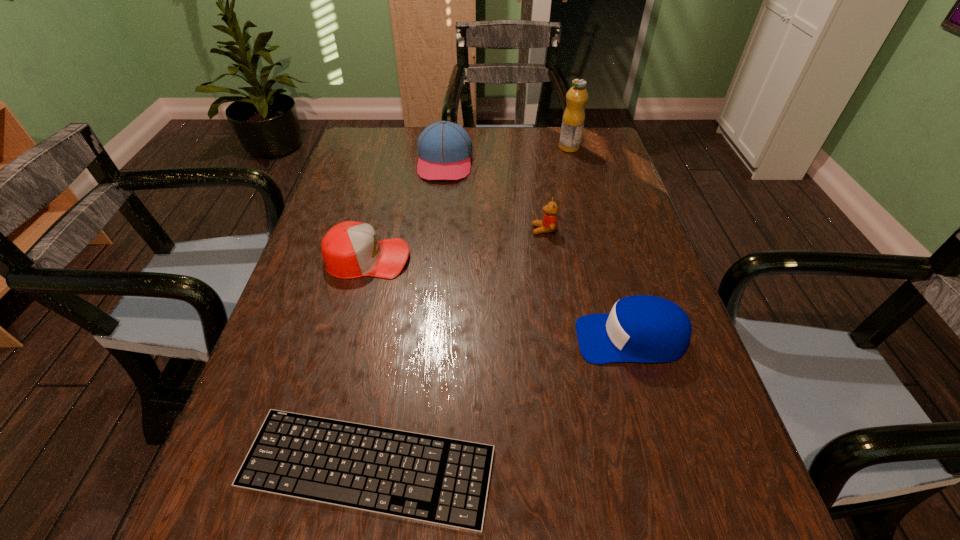
Identify the location of vacant position located on the front label of the fruit juice. Image resolution: width=960 pixels, height=540 pixels. (543, 147).

The height and width of the screenshot is (540, 960). In order to click on blank area located on the front label of the fruit juice in this screenshot , I will do `click(495, 147)`.

Find the location of a particular element. vacant area situated on the front-facing side of the tallest baseball cap is located at coordinates (438, 234).

At what (x,y) coordinates should I click in order to perform the action: click on vacant space situated on the front-facing side of the teddy bear. Please return your answer as a coordinate pair (x, y). The image size is (960, 540). Looking at the image, I should click on (410, 230).

This screenshot has height=540, width=960. I want to click on free spot located 0.260m on the front-facing side of the teddy bear, so click(430, 230).

Locate an element on the screen. The image size is (960, 540). blank area located 0.170m on the front-facing side of the teddy bear is located at coordinates (466, 230).

Image resolution: width=960 pixels, height=540 pixels. I want to click on free space located on the front-facing side of the rightmost baseball cap, so click(467, 339).

You are a GUI agent. You are given a task and a screenshot of the screen. Output one action in this format:
    pyautogui.click(x=<x>, y=<y>)
    Task: Click on the free space located 0.060m on the front-facing side of the rightmost baseball cap
    The width and height of the screenshot is (960, 540).
    Given the screenshot: What is the action you would take?
    pyautogui.click(x=546, y=339)

Image resolution: width=960 pixels, height=540 pixels. What are the coordinates of `vacant space located 0.200m on the front-facing side of the rightmost baseball cap` in the screenshot? It's located at (476, 339).

Find the location of a particular element. This screenshot has height=540, width=960. free space located 0.390m on the front-facing side of the second nearest baseball cap is located at coordinates (574, 258).